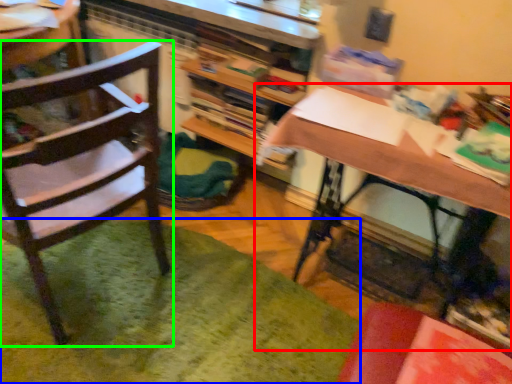
Question: Considering the real-world distances, which object is farthest from desk (highlighted by a red box)? mat (highlighted by a blue box) or chair (highlighted by a green box)?

Choices:
 (A) mat
 (B) chair

Answer: (A)